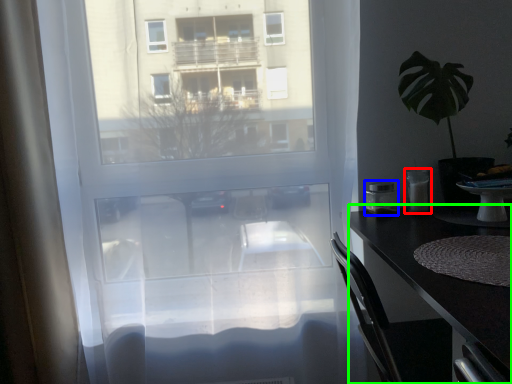
Question: Based on their relative distances, which object is farther from appliance (highlighted by a red box)? Choose from appliance (highlighted by a blue box) and desk (highlighted by a green box).

Choices:
 (A) appliance
 (B) desk

Answer: (B)